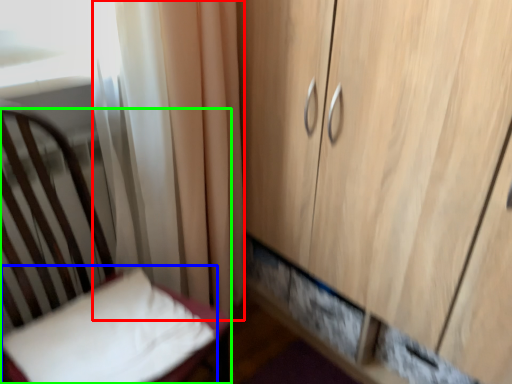
Question: Which object is the closest to the curtain (highlighted by a red box)? Choose among these: pillow (highlighted by a blue box) or furniture (highlighted by a green box).

Choices:
 (A) pillow
 (B) furniture

Answer: (B)